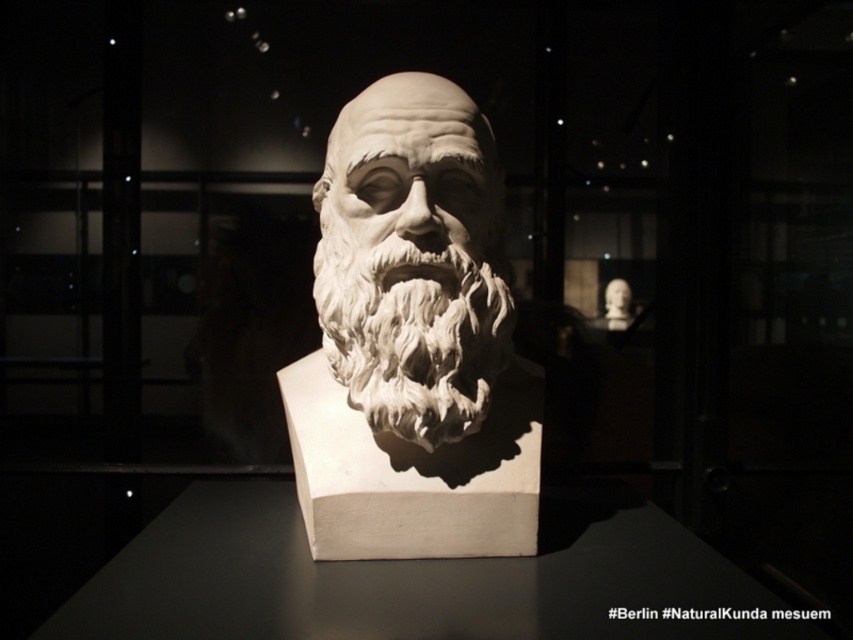
Question: Is the position of white marble bust at center more distant than that of white marble beard at center?

Choices:
 (A) yes
 (B) no

Answer: (B)

Question: Does white marble bust at center lie in front of white marble beard at center?

Choices:
 (A) no
 (B) yes

Answer: (B)

Question: Observing the image, what is the correct spatial positioning of white marble bust at center in reference to white marble beard at center?

Choices:
 (A) above
 (B) below

Answer: (A)

Question: Which point is closer to the camera?

Choices:
 (A) (347, 257)
 (B) (457, 445)

Answer: (B)